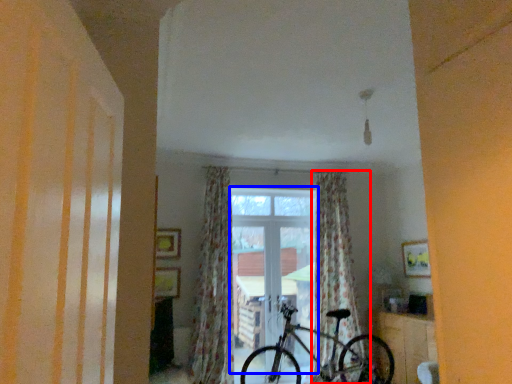
Question: Which point is closer to the camera, curtain (highlighted by a red box) or window (highlighted by a blue box)?

Choices:
 (A) curtain
 (B) window

Answer: (A)